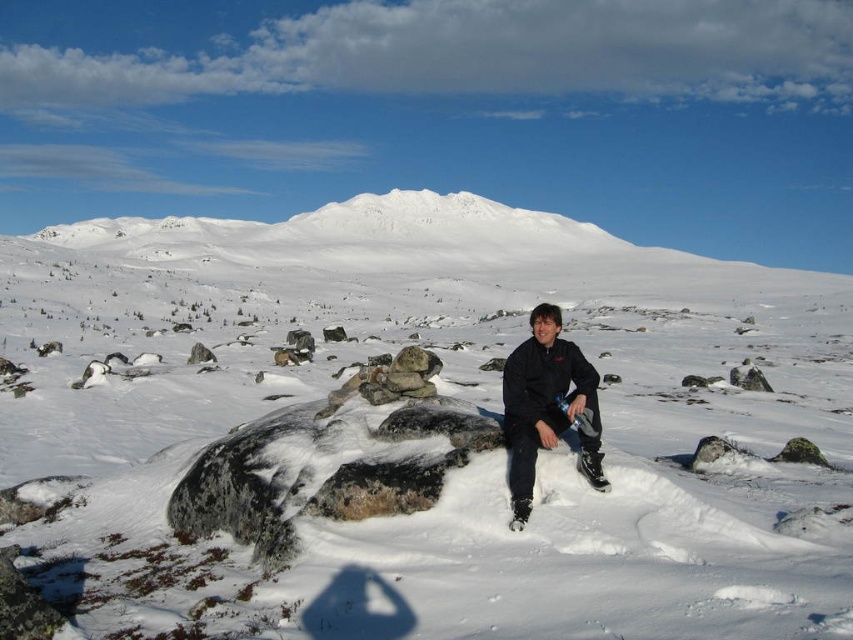
You are standing at the point with coordinates point (527, 403). You want to walk to the point with coordinates point (96, 276). Which direction should you move relative to your current position?

You should move towards the direction of point (96, 276), which is behind point (527, 403), so you need to walk backward to reach it.